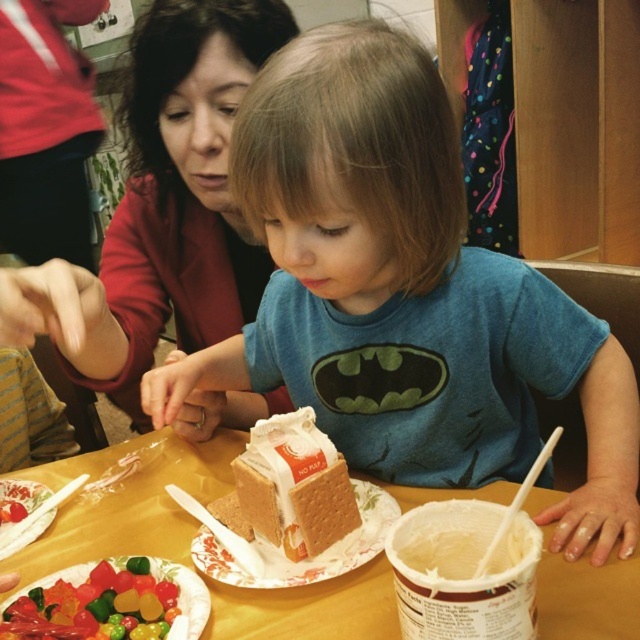
You are a photographer standing in the scene and want to take a closeup photo of the matte red sweater at upper left without moving any objects. Can you reach it with your hand? Assume your hand can extend 20 inches forward.

The matte red sweater at upper left is 18.94 inches away from viewer, so yes, you can reach it with your hand since it is within the 20 inch extension range.

You are a parent at the event and want to place a small toy between the blue cotton shirt at center and the gummy candies at center so that it doesn t fall off either side. Based on their widths, which object should the toy be closer to?

The blue cotton shirt at center is wider than the gummy candies at center. To prevent the toy from falling off either side, it should be placed closer to the gummy candies at center since it has a narrower width.